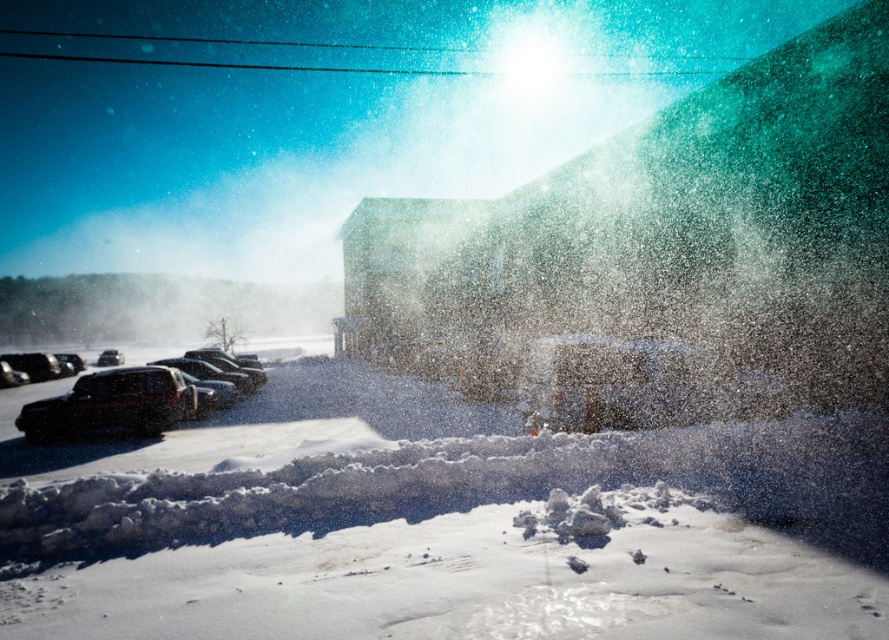
Is white fluffy snow at center shorter than black matte car at lower left?

Yes, white fluffy snow at center is shorter than black matte car at lower left.

Is white fluffy snow at center to the right of black matte car at lower left from the viewer's perspective?

Indeed, white fluffy snow at center is positioned on the right side of black matte car at lower left.

The width and height of the screenshot is (889, 640). Find the location of `white fluffy snow at center`. white fluffy snow at center is located at coordinates (438, 524).

Where is `white fluffy snow at center`? The height and width of the screenshot is (640, 889). white fluffy snow at center is located at coordinates (438, 524).

Which is above, black matte car at lower left or matte black car at left?

matte black car at left is above.

Is point (166, 384) in front of point (118, 353)?

That is True.

Which is behind, point (43, 440) or point (108, 362)?

Point (108, 362)

Find the location of `black matte car at lower left`. black matte car at lower left is located at coordinates (111, 404).

Is metallic silver car at center smaller than black matte car at lower left?

Yes.

Does metallic silver car at center have a lesser width compared to black matte car at lower left?

No, metallic silver car at center is not thinner than black matte car at lower left.

Find the location of `metallic silver car at center`. metallic silver car at center is located at coordinates click(x=637, y=385).

You are a GUI agent. You are given a task and a screenshot of the screen. Output one action in this format:
    pyautogui.click(x=<x>, y=<y>)
    Task: Click on the metallic silver car at center
    The width and height of the screenshot is (889, 640).
    Given the screenshot: What is the action you would take?
    pyautogui.click(x=637, y=385)